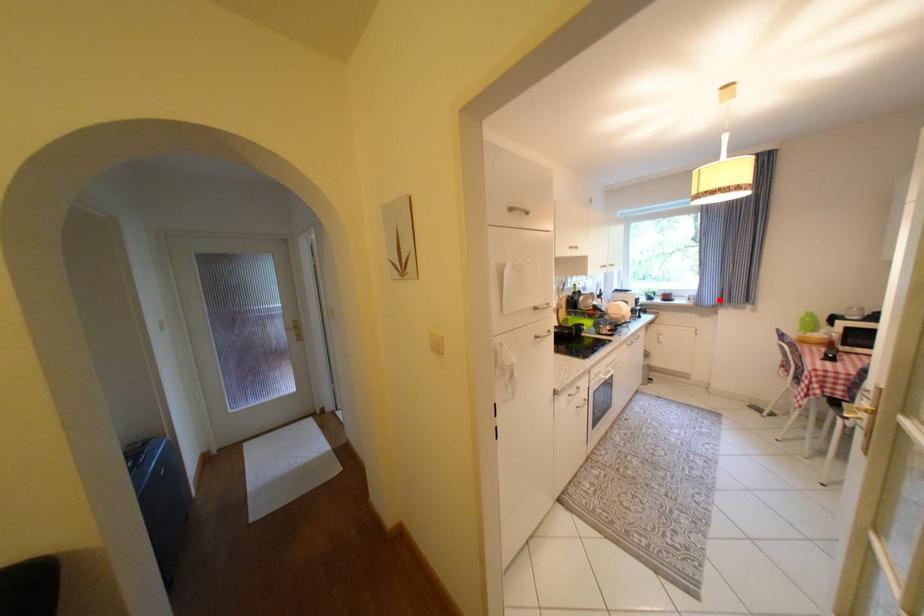
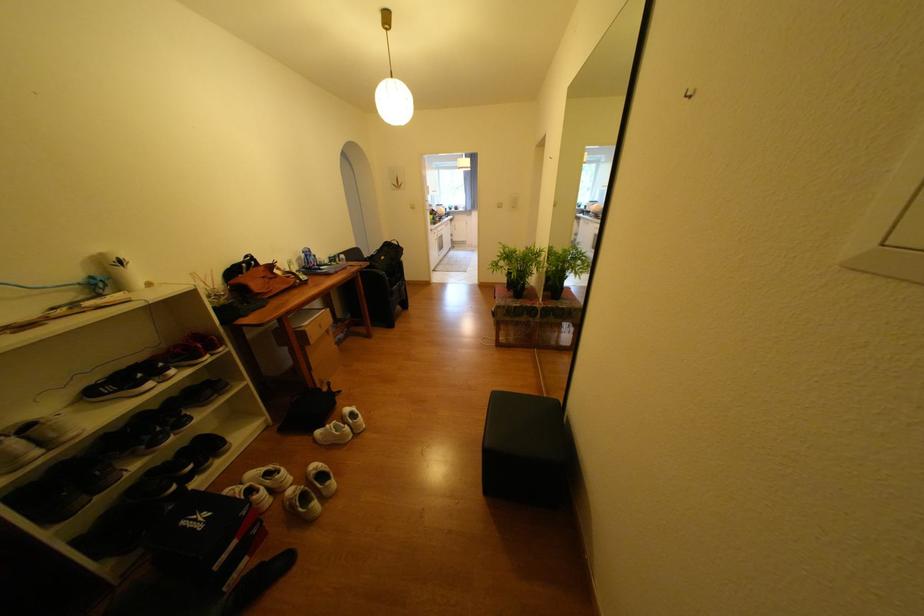
Where in the second image is the point corresponding to the highlighted location from the first image?

(479, 208)